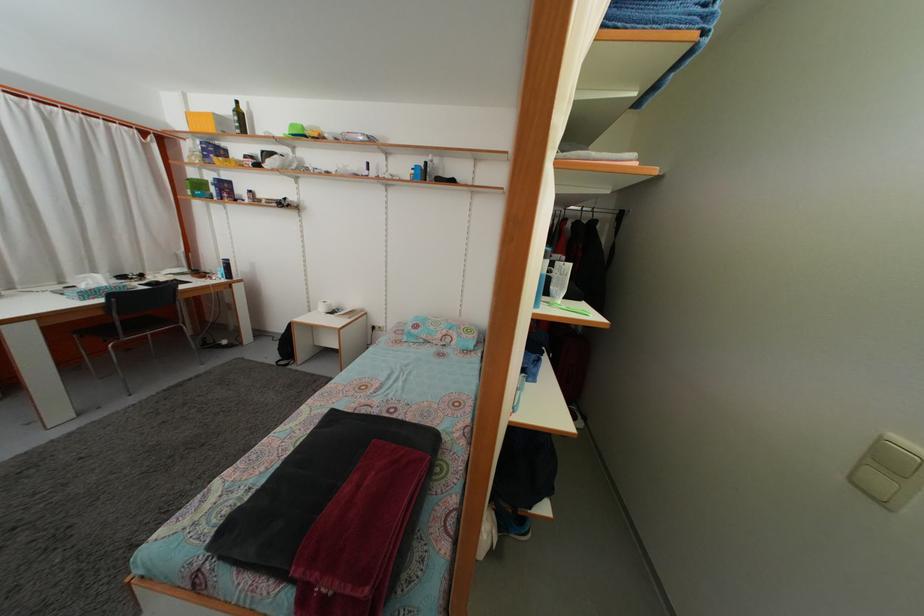
What do you see at coordinates (324, 306) in the screenshot?
I see `a toilet paper roll` at bounding box center [324, 306].